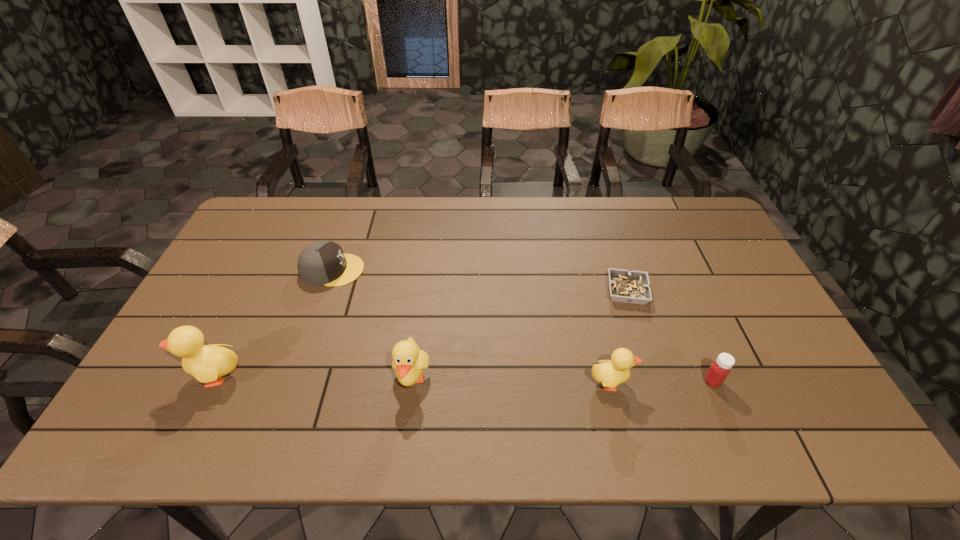
Find the location of a particular element. This screenshot has width=960, height=540. vacant space located on the front-facing side of the second object from left to right is located at coordinates (405, 270).

Where is `vacant space located on the left of the rightmost object`? The image size is (960, 540). vacant space located on the left of the rightmost object is located at coordinates (652, 381).

Identify the location of vacant space located 0.320m on the left of the shortest object. The width and height of the screenshot is (960, 540). (497, 292).

What are the coordinates of `medicine that is at the near edge` in the screenshot? It's located at (720, 368).

Locate an element on the screen. The width and height of the screenshot is (960, 540). object present at the left edge is located at coordinates (208, 364).

Locate an element on the screen. The image size is (960, 540). object positioned at the near left corner is located at coordinates (208, 364).

Locate an element on the screen. The width and height of the screenshot is (960, 540). free region at the far edge of the desktop is located at coordinates (560, 206).

Where is `vacant space at the near edge of the desktop`? The image size is (960, 540). vacant space at the near edge of the desktop is located at coordinates (271, 376).

In the image, there is a desktop. Where is `free region at the right edge`? free region at the right edge is located at coordinates (725, 264).

You are a GUI agent. You are given a task and a screenshot of the screen. Output one action in this format:
    pyautogui.click(x=<x>, y=<y>)
    Task: Click on the vacant point at the near left corner
    This screenshot has width=960, height=540.
    Given the screenshot: What is the action you would take?
    point(194,384)